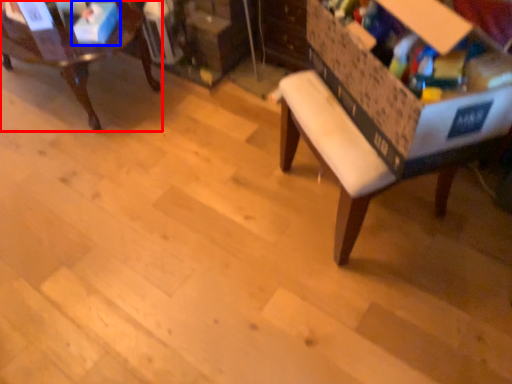
Question: Which object appears farthest to the camera in this image, chair (highlighted by a red box) or storage box (highlighted by a blue box)?

Choices:
 (A) chair
 (B) storage box

Answer: (B)